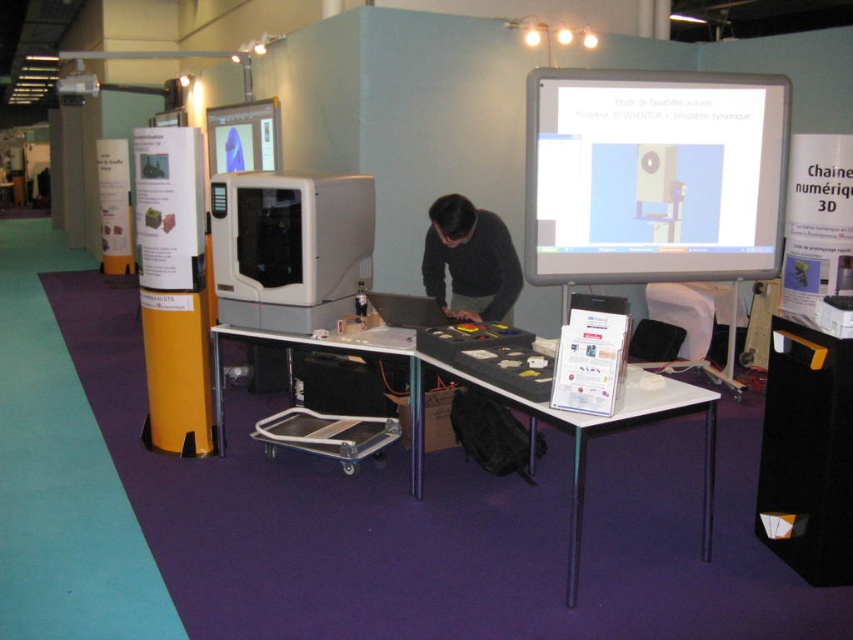
The height and width of the screenshot is (640, 853). What do you see at coordinates (469, 260) in the screenshot?
I see `dark gray sweater at center` at bounding box center [469, 260].

Locate an element on the screen. This screenshot has height=640, width=853. dark gray sweater at center is located at coordinates (469, 260).

Is point (534, 227) in front of point (212, 125)?

That is True.

Which is behind, point (701, 182) or point (250, 118)?

Positioned behind is point (250, 118).

This screenshot has width=853, height=640. I want to click on matte white projector screen at upper right, so click(654, 176).

Who is higher up, white plastic table at center or dark gray sweater at center?

dark gray sweater at center

Between white plastic table at center and dark gray sweater at center, which one is positioned lower?

white plastic table at center is lower down.

Does point (704, 470) come farther from viewer compared to point (473, 234)?

No, it is not.

The image size is (853, 640). Identify the location of white plastic table at center. (585, 420).